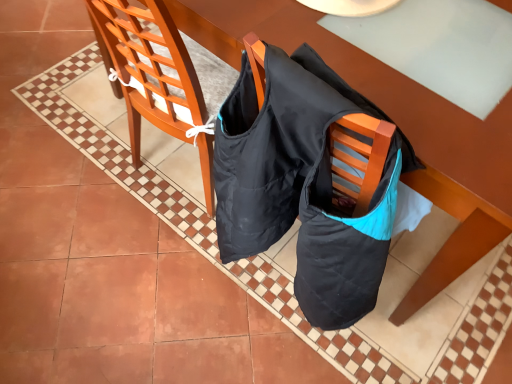
The height and width of the screenshot is (384, 512). Describe the element at coordinates (146, 66) in the screenshot. I see `matte wood chair at left` at that location.

Identify the location of matte wood chair at left. (146, 66).

What do you see at coordinates (354, 63) in the screenshot? I see `matte wood table at center` at bounding box center [354, 63].

Locate an element on the screen. This screenshot has width=512, height=384. matte wood table at center is located at coordinates (354, 63).

At what (x,y) coordinates should I click in order to perform the action: click on matte wood chair at left. Please return your answer as a coordinate pair (x, y). This screenshot has width=512, height=384. Looking at the image, I should click on (146, 66).

Which is more to the right, matte wood chair at left or matte wood table at center?

From the viewer's perspective, matte wood table at center appears more on the right side.

Looking at this image, is matte wood chair at left positioned behind matte wood table at center?

That is False.

Considering the points (146, 90) and (503, 1), which point is in front, point (146, 90) or point (503, 1)?

Point (503, 1)

From the image's perspective, is matte wood chair at left beneath matte wood table at center?

Correct, matte wood chair at left appears lower than matte wood table at center in the image.

From a real-world perspective, is matte wood chair at left physically located above or below matte wood table at center?

matte wood chair at left is situated higher than matte wood table at center in the real world.

Which of these two, matte wood chair at left or matte wood table at center, is thinner?

matte wood chair at left is thinner.

From the picture: In terms of height, does matte wood chair at left look taller or shorter compared to matte wood table at center?

Considering their sizes, matte wood chair at left has more height than matte wood table at center.

Which of these two, matte wood chair at left or matte wood table at center, is smaller?

matte wood chair at left.

Consider the image. Choose the correct answer: Is matte wood chair at left inside matte wood table at center or outside it?

matte wood chair at left is enclosed within matte wood table at center.

Is matte wood chair at left positioned far away from matte wood table at center?

No, matte wood chair at left is not far from matte wood table at center.

Is matte wood chair at left facing towards matte wood table at center?

Yes.

Locate an element on the screen. This screenshot has width=512, height=384. chair below the matte wood table at center (from the image's perspective) is located at coordinates (146, 66).

Based on their positions, is matte wood table at center located to the left or right of matte wood chair at left?

matte wood table at center is positioned on matte wood chair at left's right side.

Considering the positions of objects matte wood table at center and matte wood chair at left in the image provided, who is in front, matte wood table at center or matte wood chair at left?

matte wood chair at left.

Between point (431, 99) and point (124, 56), which one is positioned in front?

The point (431, 99) is in front.

From the image's perspective, is matte wood table at center on top of matte wood chair at left?

Yes, from the image's perspective, matte wood table at center is above matte wood chair at left.

From a real-world perspective, is matte wood table at center on top of matte wood chair at left?

No, from a real-world perspective, matte wood table at center is not over matte wood chair at left

Considering the sizes of objects matte wood table at center and matte wood chair at left in the image provided, who is thinner, matte wood table at center or matte wood chair at left?

Thinner between the two is matte wood chair at left.

In the scene shown: Considering the sizes of objects matte wood table at center and matte wood chair at left in the image provided, who is shorter, matte wood table at center or matte wood chair at left?

Standing shorter between the two is matte wood table at center.

Considering the sizes of objects matte wood table at center and matte wood chair at left in the image provided, who is bigger, matte wood table at center or matte wood chair at left?

Bigger between the two is matte wood table at center.

Is matte wood table at center outside of matte wood chair at left?

Yes, matte wood table at center is located beyond the bounds of matte wood chair at left.

Would you consider matte wood table at center to be distant from matte wood chair at left?

No, matte wood table at center is in close proximity to matte wood chair at left.

Is matte wood chair at left at the back of matte wood table at center?

Yes, matte wood chair at left is at the back of matte wood table at center.

You are a GUI agent. You are given a task and a screenshot of the screen. Output one action in this format:
    pyautogui.click(x=<x>, y=<y>)
    Task: Click on the table behind the matte wood chair at left
    
    Given the screenshot: What is the action you would take?
    pyautogui.click(x=354, y=63)

Locate an element on the screen. This screenshot has width=512, height=384. chair that is below the matte wood table at center (from the image's perspective) is located at coordinates (146, 66).

The width and height of the screenshot is (512, 384). What are the coordinates of `table that appears below the matte wood chair at left (from a real-world perspective)` in the screenshot? It's located at point(354,63).